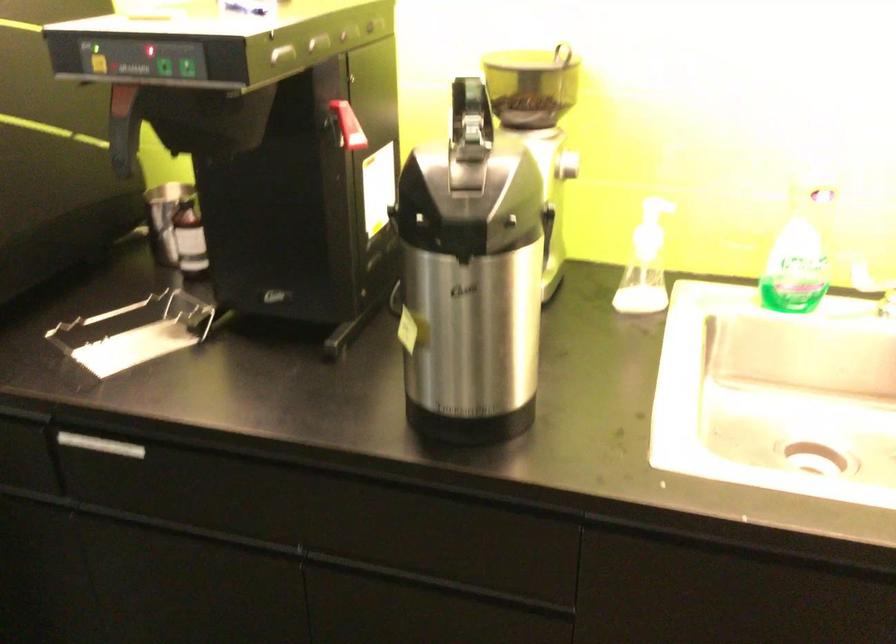
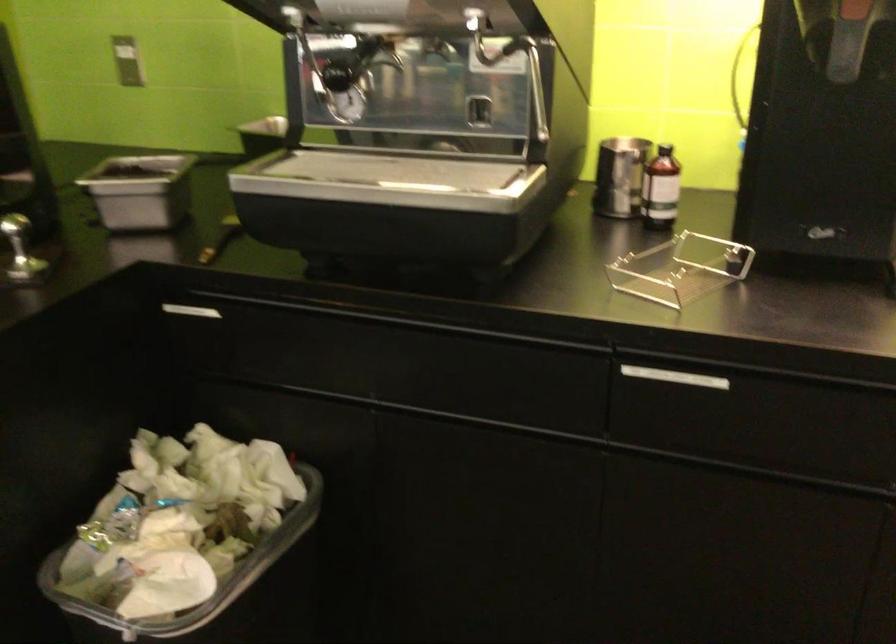
Question: Based on the continuous images, in which direction is the camera rotating? Reply with the corresponding letter.

Choices:
 (A) Left
 (B) Right
 (C) Up
 (D) Down

Answer: (A)